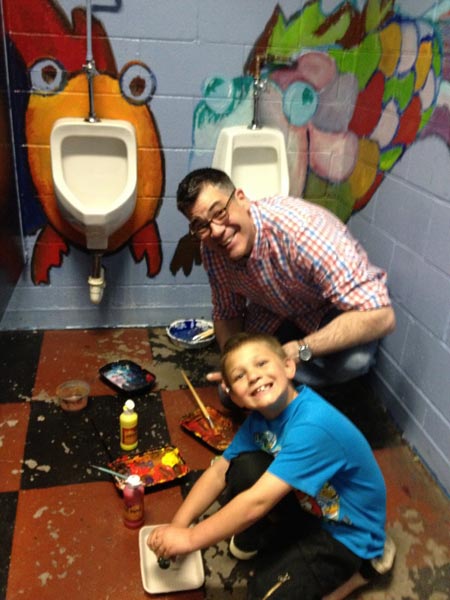
The image size is (450, 600). In order to click on paint tray in this screenshot , I will do `click(171, 575)`, `click(169, 461)`, `click(219, 436)`, `click(116, 376)`.